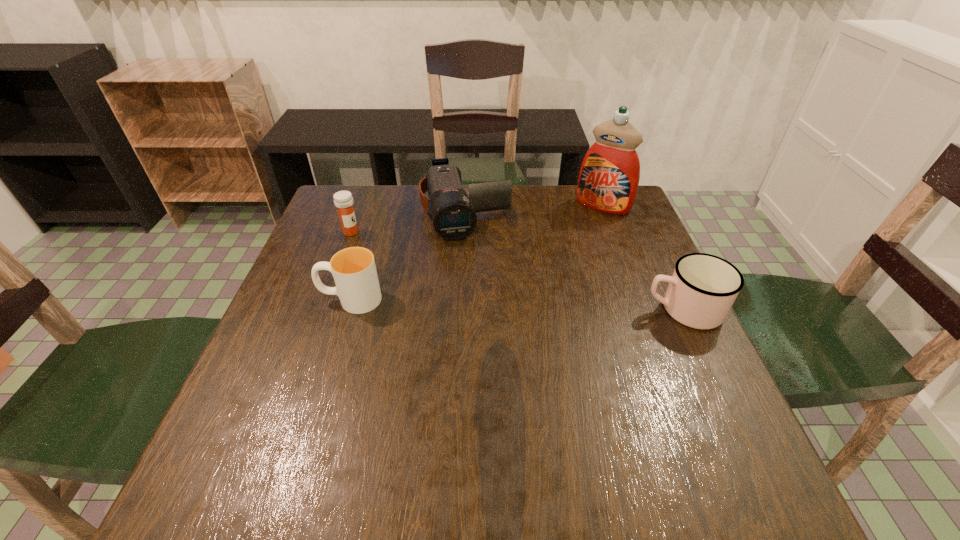
Where is `cup`? The height and width of the screenshot is (540, 960). cup is located at coordinates (357, 286).

Locate an element on the screen. Image resolution: width=960 pixels, height=540 pixels. mug is located at coordinates (702, 289).

This screenshot has width=960, height=540. I want to click on the third object from left to right, so click(x=454, y=215).

The width and height of the screenshot is (960, 540). I want to click on the tallest object, so click(609, 176).

Locate an element on the screen. medicine is located at coordinates (343, 200).

Locate an element on the screen. free space located 0.090m with the handle on the side of the cup is located at coordinates (281, 299).

Identify the location of vacant area located with the handle on the side of the cup. (294, 299).

What are the coordinates of `free space located 0.060m with the handle on the side of the cup` in the screenshot? It's located at (294, 299).

Identify the location of vacant space situated 0.060m on the side of the mug with the handle. Image resolution: width=960 pixels, height=540 pixels. (617, 309).

You are a GUI agent. You are given a task and a screenshot of the screen. Output one action in this format:
    pyautogui.click(x=<x>, y=<y>)
    Task: Click on the blank area located 0.100m on the side of the mug with the handle
    This screenshot has width=960, height=540.
    Given the screenshot: What is the action you would take?
    pyautogui.click(x=600, y=309)